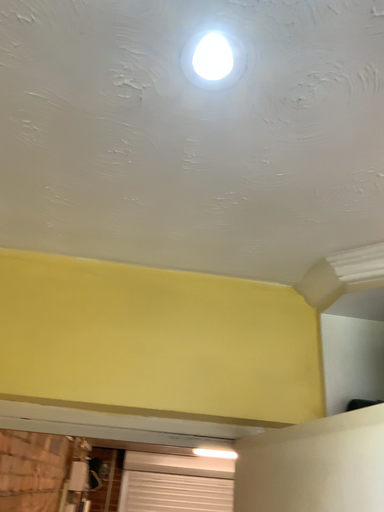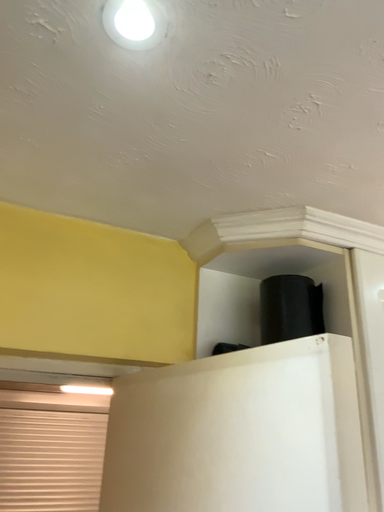
Question: Which way did the camera rotate in the video?

Choices:
 (A) rotated upward
 (B) rotated downward

Answer: (B)